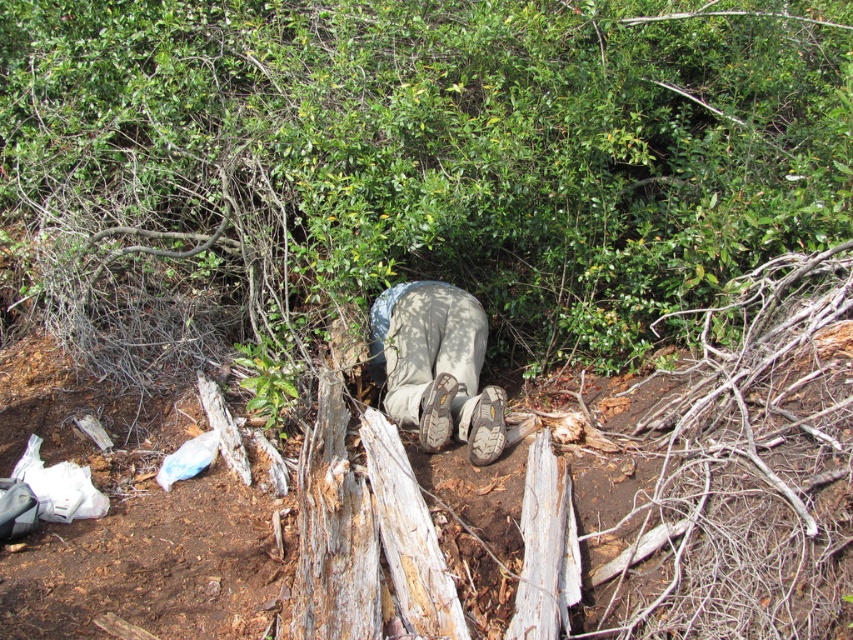
Question: Does rough bark tree trunk at center have a greater width compared to brown suede shoe at lower center?

Choices:
 (A) no
 (B) yes

Answer: (B)

Question: Estimate the real-world distances between objects in this image. Which object is closer to the white weathered wood at lower center?

Choices:
 (A) brown suede shoe at center
 (B) brown suede boots at center

Answer: (A)

Question: Which of the following is the closest to the observer?

Choices:
 (A) (488, 237)
 (B) (534, 620)
 (C) (489, 442)

Answer: (B)

Question: Can you confirm if rough bark tree trunk at center is thinner than brown suede shoe at center?

Choices:
 (A) no
 (B) yes

Answer: (A)

Question: Which object appears closest to the camera in this image?

Choices:
 (A) brown suede boots at center
 (B) brown suede shoe at center

Answer: (A)

Question: Can you confirm if white weathered wood at lower center is bigger than brown suede shoe at center?

Choices:
 (A) no
 (B) yes

Answer: (B)